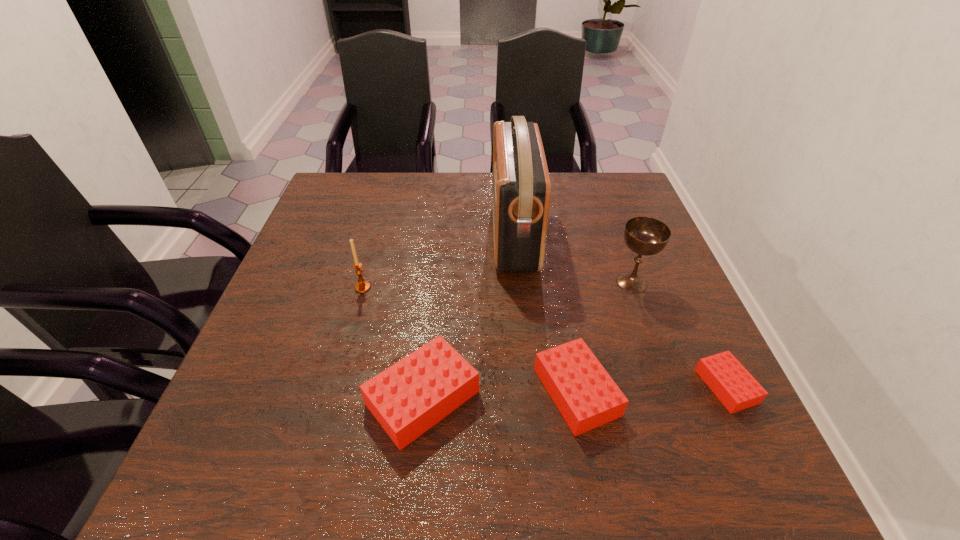
The width and height of the screenshot is (960, 540). Find the location of `vacant space that satisfies the following two spatial constraints: 1. on the front-facing side of the tallest object; 2. on the left side of the shortest Lego`. vacant space that satisfies the following two spatial constraints: 1. on the front-facing side of the tallest object; 2. on the left side of the shortest Lego is located at coordinates (528, 386).

This screenshot has height=540, width=960. Find the location of `vacant space that satisfies the following two spatial constraints: 1. on the front-facing side of the second Lego from right to left; 2. on the left side of the tallest object`. vacant space that satisfies the following two spatial constraints: 1. on the front-facing side of the second Lego from right to left; 2. on the left side of the tallest object is located at coordinates (529, 392).

Where is `free space that satisfies the following two spatial constraints: 1. on the back side of the rightmost object; 2. on the front-facing side of the radio receiver`? free space that satisfies the following two spatial constraints: 1. on the back side of the rightmost object; 2. on the front-facing side of the radio receiver is located at coordinates (655, 235).

You are a GUI agent. You are given a task and a screenshot of the screen. Output one action in this format:
    pyautogui.click(x=<x>, y=<y>)
    Task: Click on the vacant region that satisfies the following two spatial constraints: 1. on the back side of the rightmost Lego; 2. on the right side of the second tallest Lego
    The width and height of the screenshot is (960, 540).
    Given the screenshot: What is the action you would take?
    pyautogui.click(x=575, y=386)